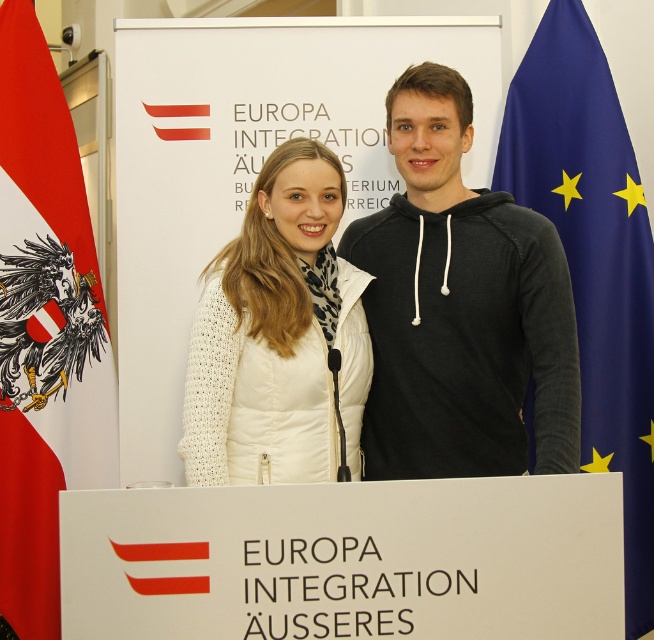
Who is positioned more to the left, blue fabric flag at right or white knitted jacket at center?

white knitted jacket at center

Is point (525, 188) closer to camera compared to point (192, 426)?

That is False.

Locate an element on the screen. Image resolution: width=654 pixels, height=640 pixels. blue fabric flag at right is located at coordinates (593, 257).

At what (x,y) coordinates should I click in order to perform the action: click on blue fabric flag at right. Please return your answer as a coordinate pair (x, y). Looking at the image, I should click on (593, 257).

Who is taller, black hoodie at center or red fabric flag at left?

red fabric flag at left is taller.

Looking at this image, is black hoodie at center in front of red fabric flag at left?

Yes, black hoodie at center is closer to the viewer.

Locate an element on the screen. This screenshot has height=640, width=654. black hoodie at center is located at coordinates (460, 307).

Is point (69, 308) less distant than point (594, 465)?

No, (69, 308) is behind (594, 465).

Is red fabric flag at left shorter than blue fabric flag at right?

Yes.

Is point (27, 413) behind point (625, 424)?

No.

Find the location of a particular element. Image resolution: width=654 pixels, height=640 pixels. red fabric flag at left is located at coordinates (43, 324).